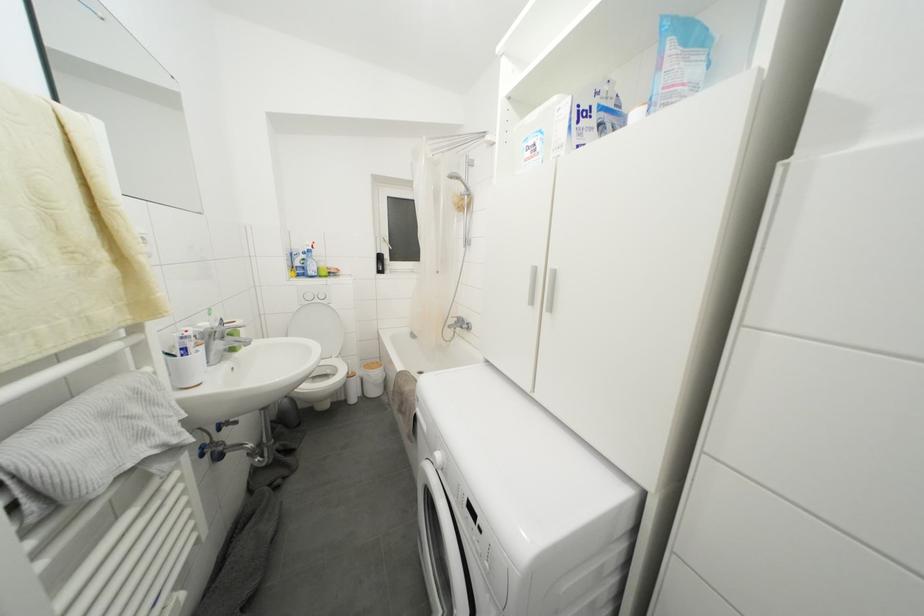
The image size is (924, 616). Describe the element at coordinates (438, 459) in the screenshot. I see `the washing machine handle` at that location.